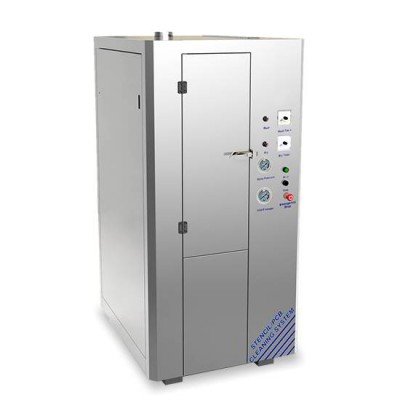
Find the location of a particular element. Image resolution: width=400 pixels, height=400 pixels. hinges is located at coordinates (182, 87), (182, 226).